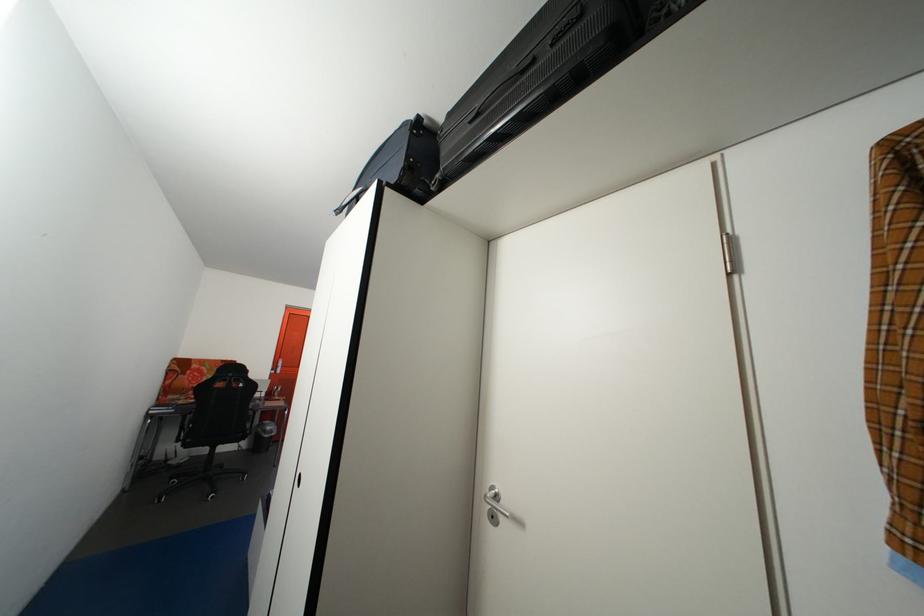
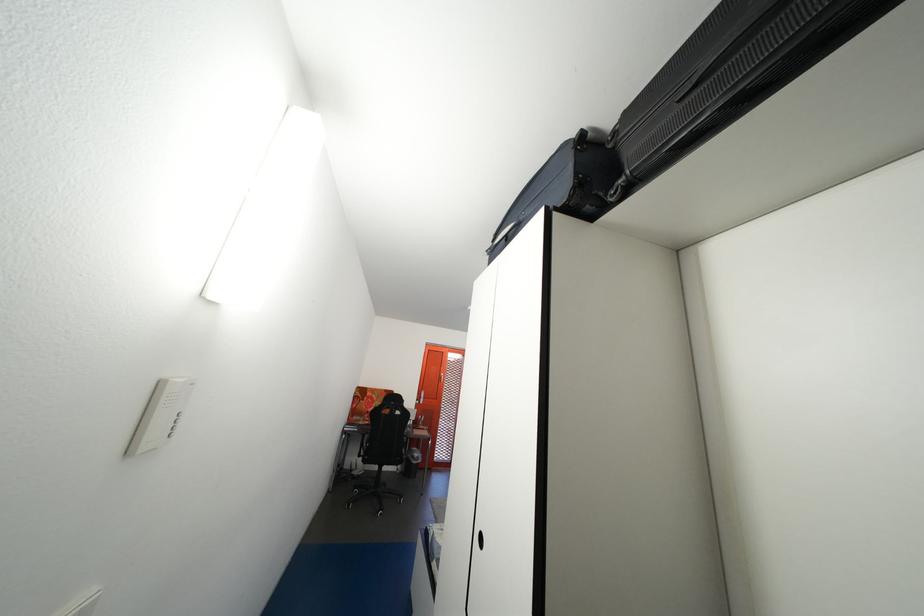
Locate, in the second image, the point that corresponds to (x=179, y=454) in the first image.

(365, 467)